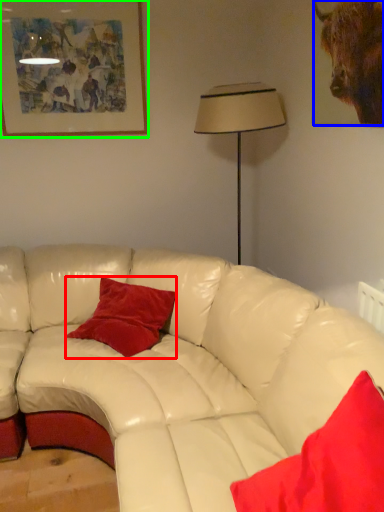
Question: Which object is positioned closest to pillow (highlighted by a red box)? Select from bull (highlighted by a blue box) and picture frame (highlighted by a green box).

Choices:
 (A) bull
 (B) picture frame

Answer: (B)